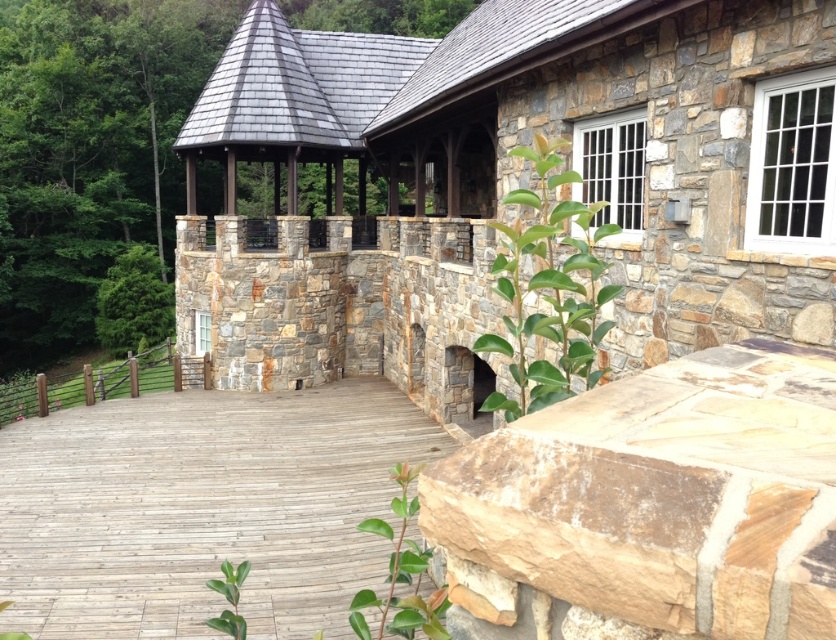
You are planning to host a small gathering and need to know which area is larger between the natural stone wall at center and the wooden deck at center. Which one should you choose for more seating space?

The wooden deck at center is larger because the natural stone wall at center occupies less space than it, providing more area for seating.

You are standing on the wooden deck and want to walk towards the natural stone wall at center. Which direction should you head relative to the natural stone gazebo at center?

You should head to the right of the natural stone gazebo at center to reach the natural stone wall at center because the natural stone gazebo at center is to the left of the natural stone wall at center.